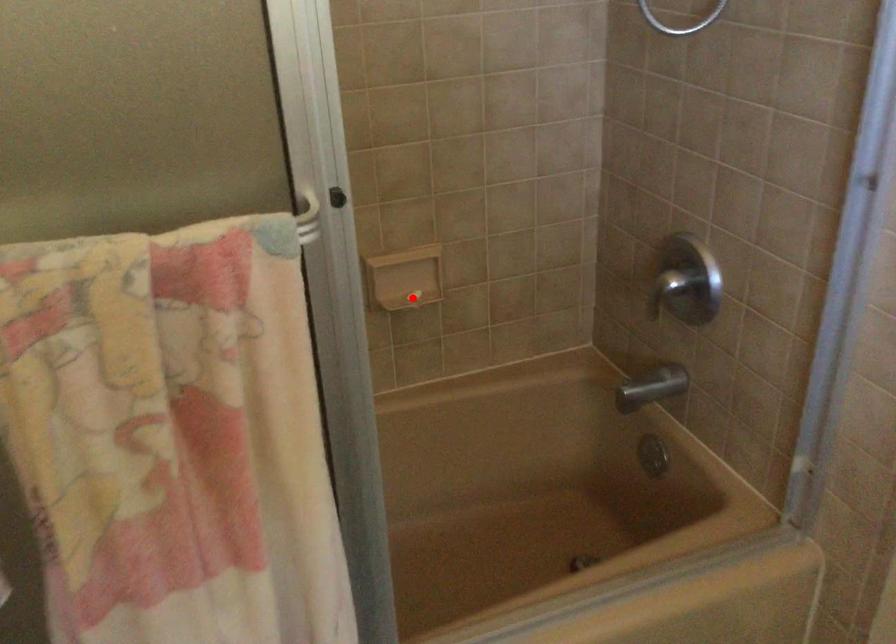
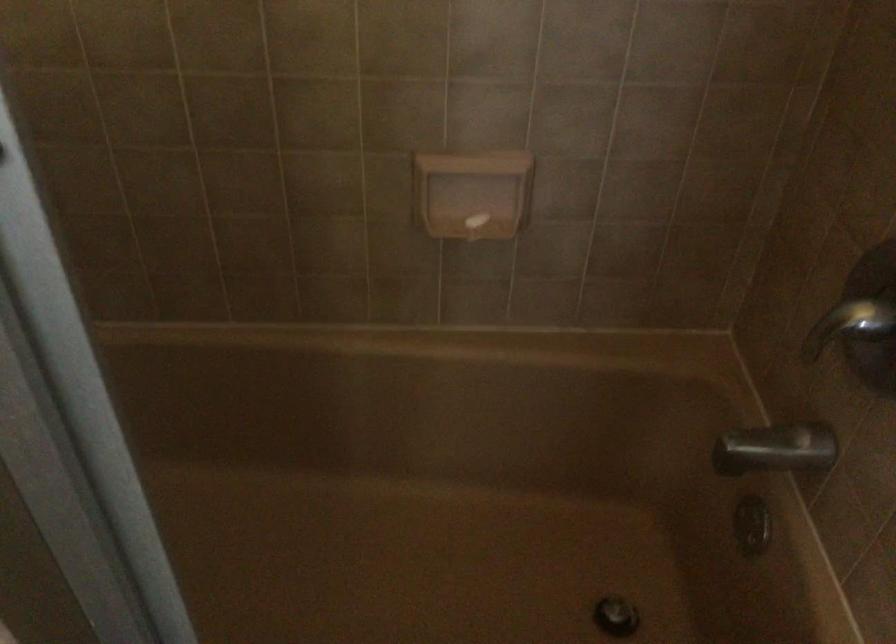
Question: I am providing you with two images of the same scene from different viewpoints. In image1, a red point is highlighted. Considering the same 3D point in image2, which of the following is correct?

Choices:
 (A) It is closer
 (B) It is farther

Answer: (A)